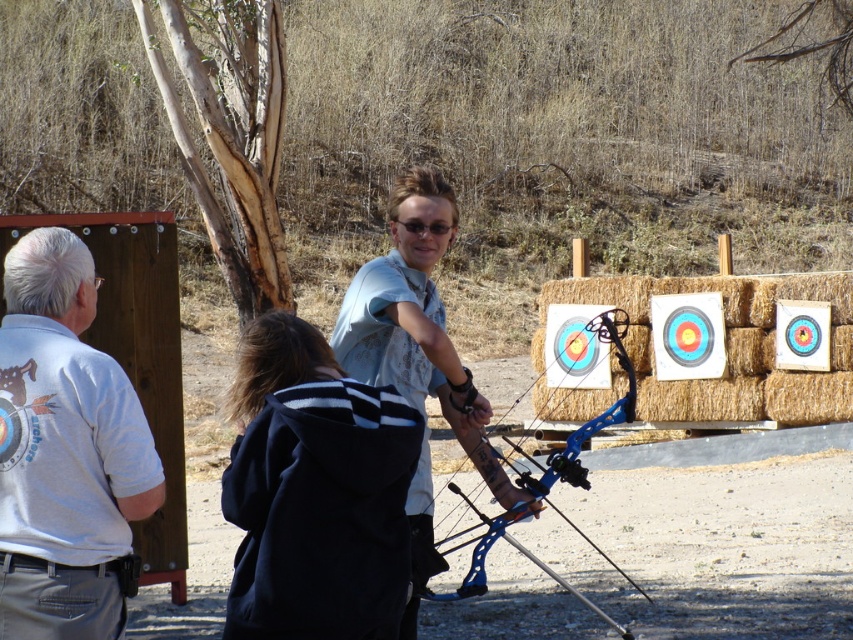
Question: Can you confirm if light blue t-shirt at center is positioned below blue metallic bow at center?

Choices:
 (A) yes
 (B) no

Answer: (B)

Question: Does light blue t-shirt at center have a lesser width compared to blue metallic bow at center?

Choices:
 (A) yes
 (B) no

Answer: (A)

Question: Considering the relative positions of black fleece jacket at center and light blue t-shirt at center in the image provided, where is black fleece jacket at center located with respect to light blue t-shirt at center?

Choices:
 (A) right
 (B) left

Answer: (B)

Question: Which of the following is the closest to the observer?

Choices:
 (A) light blue t-shirt at center
 (B) white cotton shirt at left
 (C) black fleece jacket at center
 (D) blue metallic bow at center

Answer: (C)

Question: Which object is the farthest from the black fleece jacket at center?

Choices:
 (A) blue metallic bow at center
 (B) light blue t-shirt at center
 (C) white cotton shirt at left

Answer: (A)

Question: Among these points, which one is farthest from the camera?

Choices:
 (A) (518, 474)
 (B) (432, 547)
 (C) (44, 502)

Answer: (A)